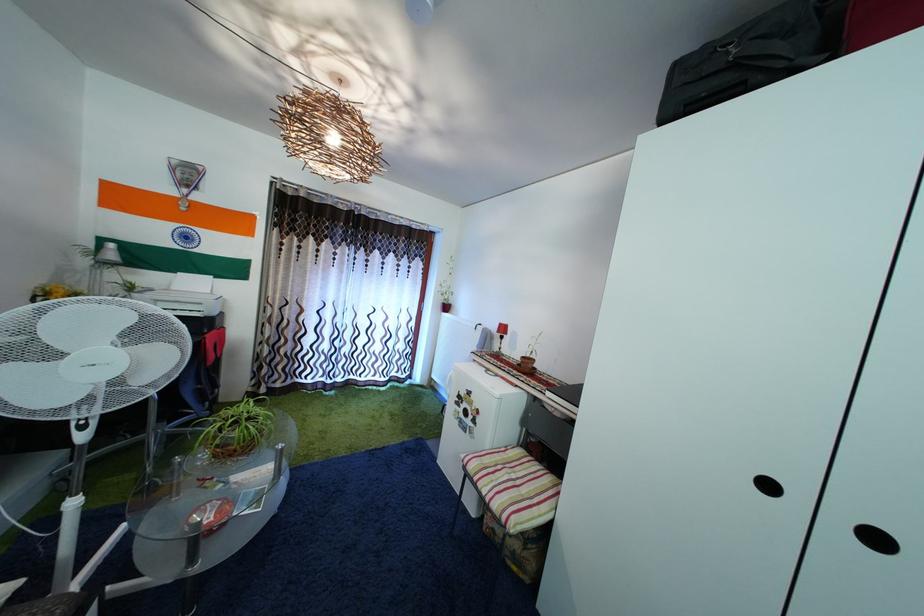
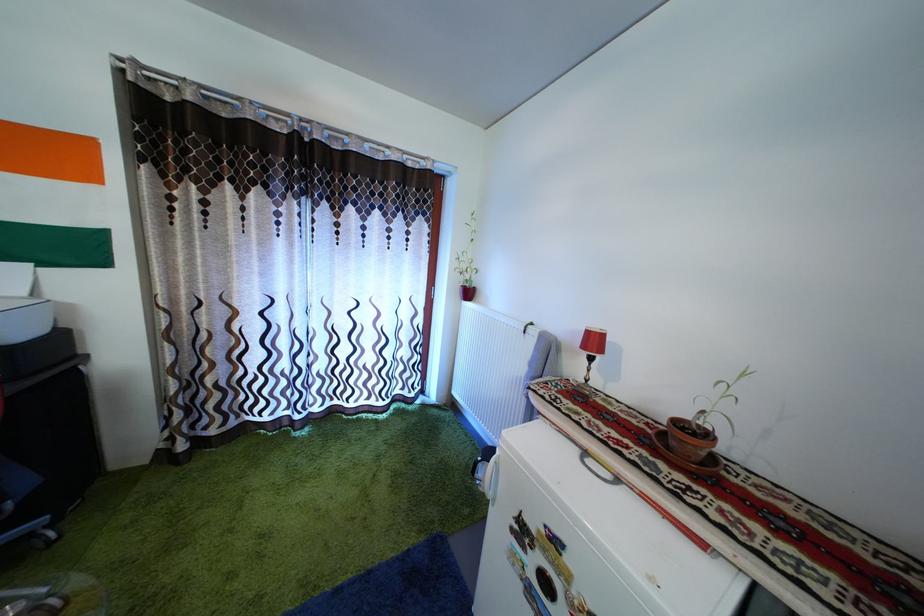
The point at (x=508, y=331) is marked in the first image. Where is the corresponding point in the second image?

(598, 339)